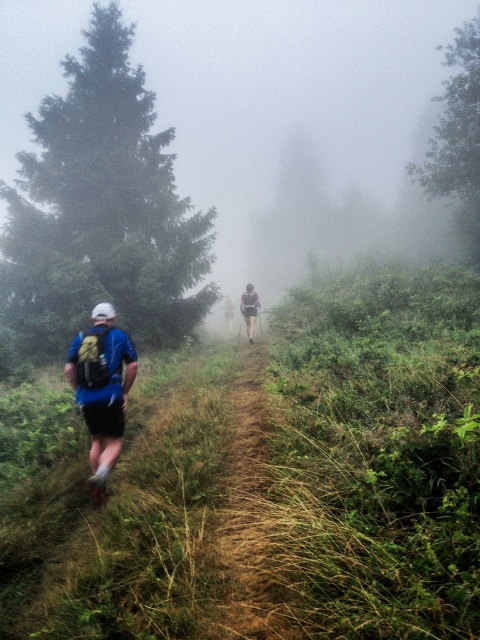
Is brown grassy trail at center closer to the viewer compared to blue fabric backpack at left?

Yes, brown grassy trail at center is in front of blue fabric backpack at left.

Does brown grassy trail at center appear on the right side of blue fabric backpack at left?

Yes, brown grassy trail at center is to the right of blue fabric backpack at left.

What do you see at coordinates (244, 502) in the screenshot?
I see `brown grassy trail at center` at bounding box center [244, 502].

Identify the location of brown grassy trail at center. The width and height of the screenshot is (480, 640). (244, 502).

Between blue fabric backpack at left and green fabric backpack at center, which one appears on the left side from the viewer's perspective?

blue fabric backpack at left is more to the left.

Is point (111, 444) farther from camera compared to point (226, 324)?

No, (111, 444) is closer to viewer.

The height and width of the screenshot is (640, 480). In order to click on blue fabric backpack at left in this screenshot , I will do `click(101, 388)`.

Can you confirm if green matte tree at left is positioned to the left of brown grassy trail at center?

Indeed, green matte tree at left is positioned on the left side of brown grassy trail at center.

Is the position of green matte tree at left more distant than that of brown grassy trail at center?

Yes, green matte tree at left is behind brown grassy trail at center.

Find the location of `green matte tree at left`. green matte tree at left is located at coordinates (101, 211).